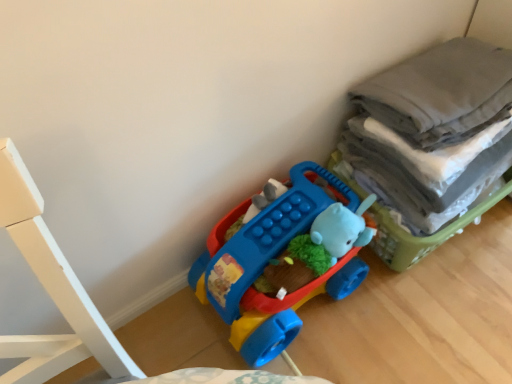
This screenshot has height=384, width=512. What do you see at coordinates (278, 262) in the screenshot? I see `matte plastic toy car at center` at bounding box center [278, 262].

Image resolution: width=512 pixels, height=384 pixels. I want to click on matte plastic toy car at center, so click(278, 262).

Measure the distance between point (501, 123) and camera.

Point (501, 123) and camera are 1.07 meters apart from each other.

This screenshot has width=512, height=384. What do you see at coordinates (434, 129) in the screenshot? I see `gray cotton laundry at right` at bounding box center [434, 129].

I want to click on gray cotton laundry at right, so click(434, 129).

What is the approximate height of gray cotton laundry at right?

13.64 inches.

At what (x,y) coordinates should I click in order to perform the action: click on matte plastic toy car at center. Please return your answer as a coordinate pair (x, y). Looking at the image, I should click on (278, 262).

Based on the photo, which is more to the left, gray cotton laundry at right or matte plastic toy car at center?

Positioned to the left is matte plastic toy car at center.

Is gray cotton laundry at right further to the viewer compared to matte plastic toy car at center?

No, gray cotton laundry at right is in front of matte plastic toy car at center.

Does point (418, 191) appear closer or farther from the camera than point (291, 319)?

Clearly, point (418, 191) is closer to the camera than point (291, 319).

From the image's perspective, would you say gray cotton laundry at right is shown under matte plastic toy car at center?

Incorrect, from the image's perspective, gray cotton laundry at right is higher than matte plastic toy car at center.

From a real-world perspective, between gray cotton laundry at right and matte plastic toy car at center, who is vertically higher?

In real-world perspective, gray cotton laundry at right is above.

Considering the relative sizes of gray cotton laundry at right and matte plastic toy car at center in the image provided, is gray cotton laundry at right wider than matte plastic toy car at center?

Indeed, gray cotton laundry at right has a greater width compared to matte plastic toy car at center.

Between gray cotton laundry at right and matte plastic toy car at center, which one has more height?

Standing taller between the two is gray cotton laundry at right.

Considering the relative sizes of gray cotton laundry at right and matte plastic toy car at center in the image provided, is gray cotton laundry at right smaller than matte plastic toy car at center?

No.

Can we say gray cotton laundry at right lies outside matte plastic toy car at center?

Yes, gray cotton laundry at right is outside of matte plastic toy car at center.

Is gray cotton laundry at right directly adjacent to matte plastic toy car at center?

They are not placed beside each other.

Does gray cotton laundry at right turn towards matte plastic toy car at center?

No, gray cotton laundry at right does not turn towards matte plastic toy car at center.

What's the angular difference between gray cotton laundry at right and matte plastic toy car at center's facing directions?

0.000221 degrees.

The image size is (512, 384). Find the location of `laundry above the matte plastic toy car at center (from the image's perspective)`. laundry above the matte plastic toy car at center (from the image's perspective) is located at coordinates click(434, 129).

Which is more to the left, matte plastic toy car at center or gray cotton laundry at right?

Positioned to the left is matte plastic toy car at center.

Considering their positions, is matte plastic toy car at center located in front of or behind gray cotton laundry at right?

In the image, matte plastic toy car at center appears behind gray cotton laundry at right.

Which is farther, (257,338) or (435,55)?

The point (435,55) is behind.

From the image's perspective, is matte plastic toy car at center located above or below gray cotton laundry at right?

Clearly, from the image's perspective, matte plastic toy car at center is below gray cotton laundry at right.

From a real-world perspective, between matte plastic toy car at center and gray cotton laundry at right, who is vertically higher?

gray cotton laundry at right, from a real-world perspective.

Is matte plastic toy car at center wider or thinner than gray cotton laundry at right?

matte plastic toy car at center is thinner than gray cotton laundry at right.

Between matte plastic toy car at center and gray cotton laundry at right, which one has more height?

gray cotton laundry at right.

Who is bigger, matte plastic toy car at center or gray cotton laundry at right?

Bigger between the two is gray cotton laundry at right.

Is matte plastic toy car at center positioned beyond the bounds of gray cotton laundry at right?

matte plastic toy car at center lies outside gray cotton laundry at right's area.

Is matte plastic toy car at center next to gray cotton laundry at right?

matte plastic toy car at center is not next to gray cotton laundry at right, and they're not touching.

Is matte plastic toy car at center facing towards gray cotton laundry at right?

No, matte plastic toy car at center does not turn towards gray cotton laundry at right.

Find the location of a particular element. The width and height of the screenshot is (512, 384). toy that appears below the gray cotton laundry at right (from a real-world perspective) is located at coordinates (278, 262).

Locate an element on the screen. The image size is (512, 384). laundry above the matte plastic toy car at center (from the image's perspective) is located at coordinates (434, 129).

The width and height of the screenshot is (512, 384). In order to click on laundry located above the matte plastic toy car at center (from a real-world perspective) in this screenshot , I will do `click(434, 129)`.